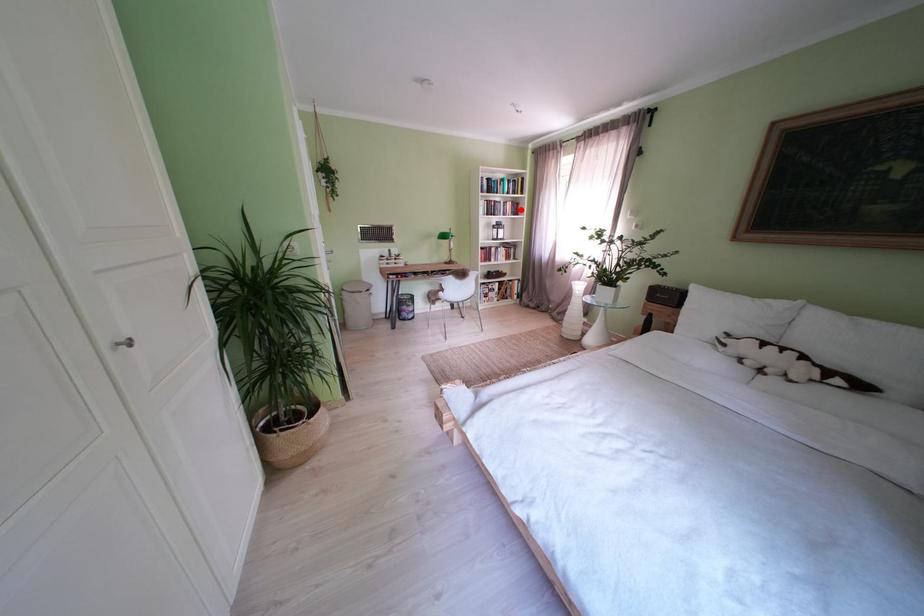
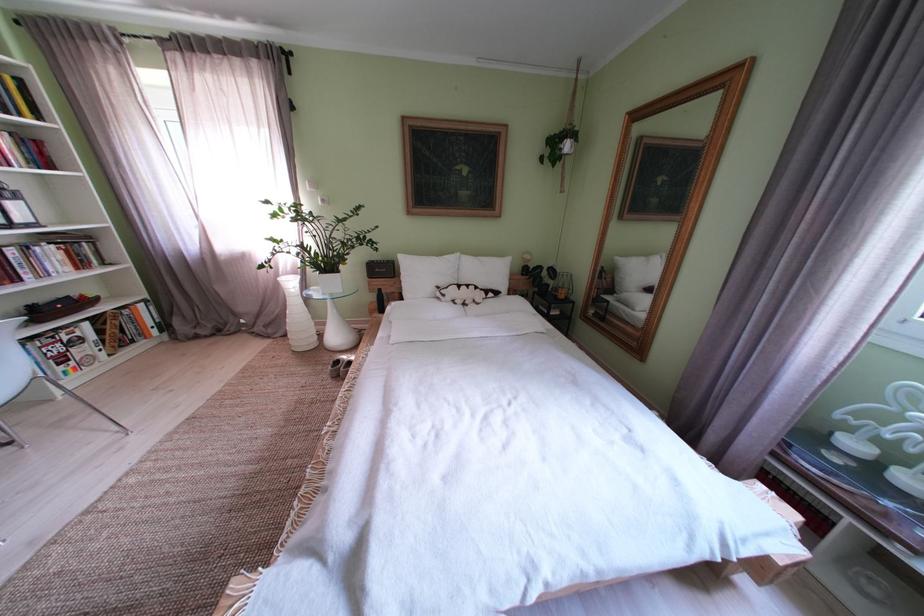
In the second image, find the point that corresponds to the highlighted location in the first image.

(16, 145)